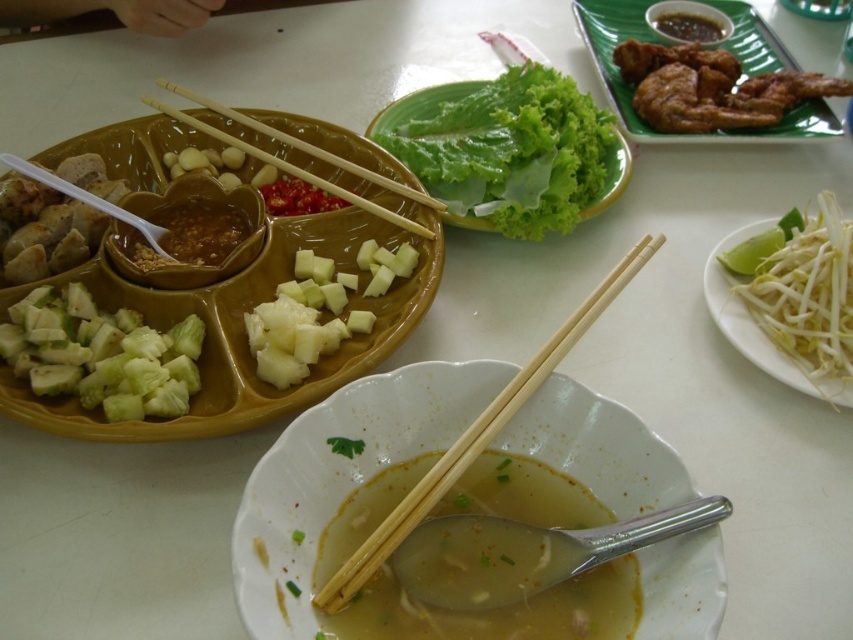
Looking at this image, you are a person with a height of 6 feet. You are sitting at the table and want to reach the white ceramic bowl at center. Can you comfortably reach it without moving your chair?

The white ceramic bowl at center is 18.90 inches away from the viewer. Since the average comfortable reaching distance for an adult is about 22 inches, you can comfortably reach it without moving your chair.

You are a photographer trying to capture a closeup shot of the brown segmented serving dish with the spoon in the sauce container. The camera is positioned at the center of the table. The spoon in the sauce container is located at point (728, 330). To get the best focus, you need to adjust the camera so that the spoon is exactly 30 inches away. Should you move the camera closer or farther away from the spoon?

The point (728, 330) is currently 32.10 inches away from the camera. To reduce the distance to 30 inches, you should move the camera closer to the spoon.

You are a diner at the table and want to reach both the white bean sprouts at lower right and the brown glossy sauce at upper center. Which one is closer to your right side?

The white bean sprouts at lower right is to the left of the brown glossy sauce at upper center, so the brown glossy sauce at upper center is closer to your right side.